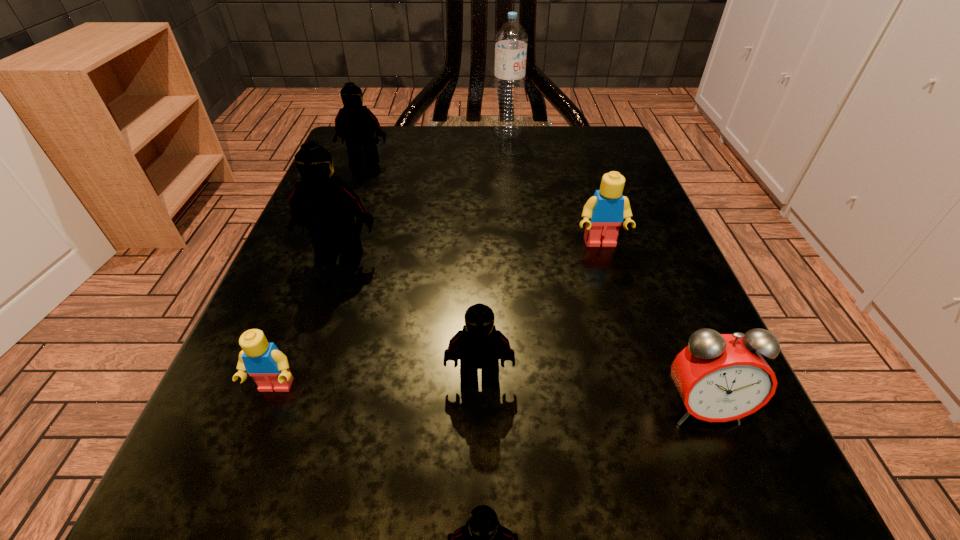
Identify the location of the smaller yellow Lego. The height and width of the screenshot is (540, 960). (264, 362).

Locate an element on the screen. The image size is (960, 540). the left yellow Lego is located at coordinates (264, 362).

I want to click on vacant area situated on the front of the water bottle, so click(x=510, y=156).

I want to click on free space located 0.240m on the face of the second tallest object, so click(x=285, y=416).

Where is `free space located 0.360m on the face of the second farthest object`? This screenshot has width=960, height=540. free space located 0.360m on the face of the second farthest object is located at coordinates 312,305.

You are a GUI agent. You are given a task and a screenshot of the screen. Output one action in this format:
    pyautogui.click(x=<x>, y=<y>)
    Task: Click on the free space located 0.080m on the front-facing side of the farther yellow Lego
    The width and height of the screenshot is (960, 540).
    Given the screenshot: What is the action you would take?
    pyautogui.click(x=614, y=291)

The image size is (960, 540). What are the coordinates of `vacant space located on the face of the second nearest black Lego` in the screenshot? It's located at (479, 515).

The width and height of the screenshot is (960, 540). What are the coordinates of `blank area located 0.130m on the front-facing side of the nearer yellow Lego` in the screenshot? It's located at (222, 530).

You are a GUI agent. You are given a task and a screenshot of the screen. Output one action in this format:
    pyautogui.click(x=<x>, y=<y>)
    Task: Click on the water bottle present at the far edge
    
    Given the screenshot: What is the action you would take?
    pyautogui.click(x=511, y=40)

Find the location of `Lego situated at the far edge`. Lego situated at the far edge is located at coordinates (356, 124).